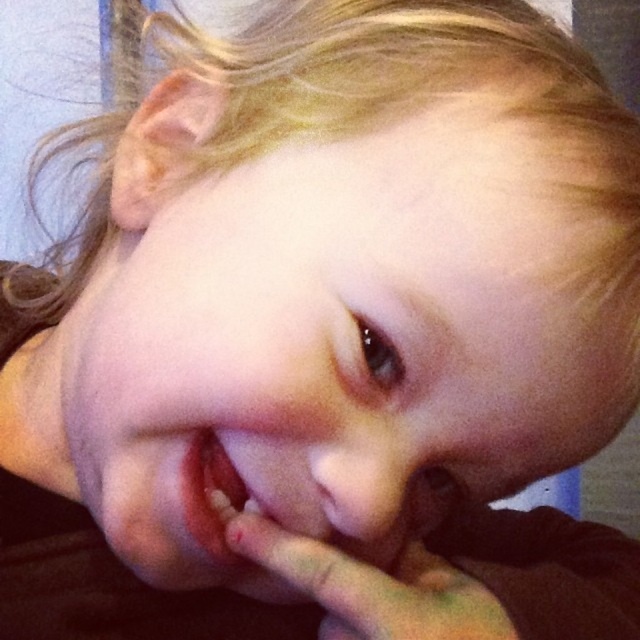
Question: Estimate the real-world distances between objects in this image. Which object is closer to the smooth skin face at center?

Choices:
 (A) pink matte tooth at center
 (B) smooth skin hand at lower center

Answer: (B)

Question: Which object appears closest to the camera in this image?

Choices:
 (A) smooth skin hand at lower center
 (B) smooth skin face at center
 (C) pink matte tooth at center

Answer: (B)

Question: Is smooth skin face at center wider than smooth skin hand at lower center?

Choices:
 (A) yes
 (B) no

Answer: (A)

Question: Is smooth skin face at center smaller than pink matte tooth at center?

Choices:
 (A) yes
 (B) no

Answer: (B)

Question: Which object is positioned closest to the smooth skin hand at lower center?

Choices:
 (A) pink matte tooth at center
 (B) smooth skin face at center

Answer: (A)

Question: Does smooth skin hand at lower center appear under pink matte tooth at center?

Choices:
 (A) yes
 (B) no

Answer: (A)